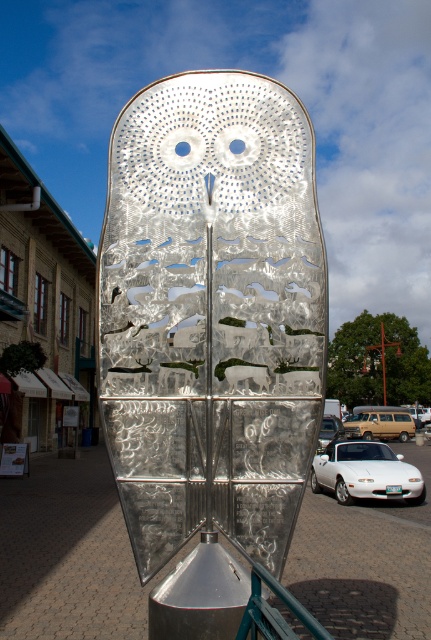
The width and height of the screenshot is (431, 640). Describe the element at coordinates (274, 611) in the screenshot. I see `metal/textured rail at lower center` at that location.

Which is in front, point (275, 630) or point (387, 417)?

Point (275, 630) is more forward.

Is point (252, 588) closer to viewer compared to point (364, 426)?

Yes, point (252, 588) is in front of point (364, 426).

This screenshot has width=431, height=640. In order to click on metal/textured rail at lower center in this screenshot , I will do `click(274, 611)`.

Can you confirm if metal/textured rail at lower center is smaller than white glossy car at center?

Yes.

Is metal/textured rail at lower center closer to the viewer compared to white glossy car at center?

Yes, metal/textured rail at lower center is closer to the viewer.

At what (x,y) coordinates should I click in order to perform the action: click on metal/textured rail at lower center. Please return your answer as a coordinate pair (x, y). Looking at the image, I should click on (274, 611).

Where is `metal/textured rail at lower center`? This screenshot has width=431, height=640. metal/textured rail at lower center is located at coordinates (274, 611).

Does white glossy car at lower center have a larger size compared to metal/textured rail at lower center?

Yes, white glossy car at lower center is bigger than metal/textured rail at lower center.

Does point (394, 476) come farther from viewer compared to point (321, 630)?

Yes, it is.

The width and height of the screenshot is (431, 640). I want to click on white glossy car at lower center, so click(x=365, y=474).